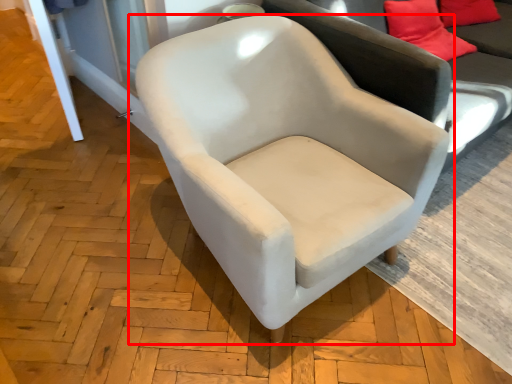
Question: Observing the image, what is the correct spatial positioning of chair (annotated by the red box) in reference to studio couch?

Choices:
 (A) left
 (B) right

Answer: (A)